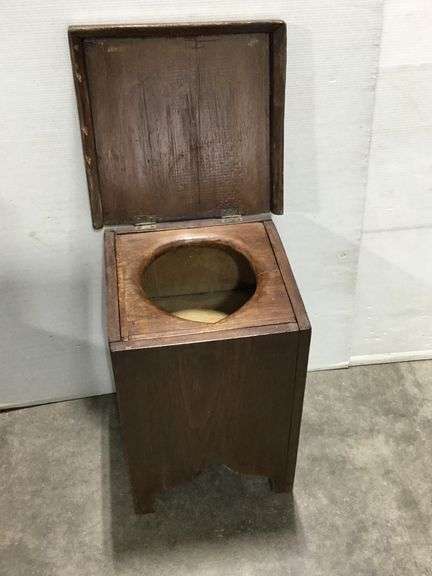
Find the location of `hinges`. hinges is located at coordinates (237, 214), (139, 221).